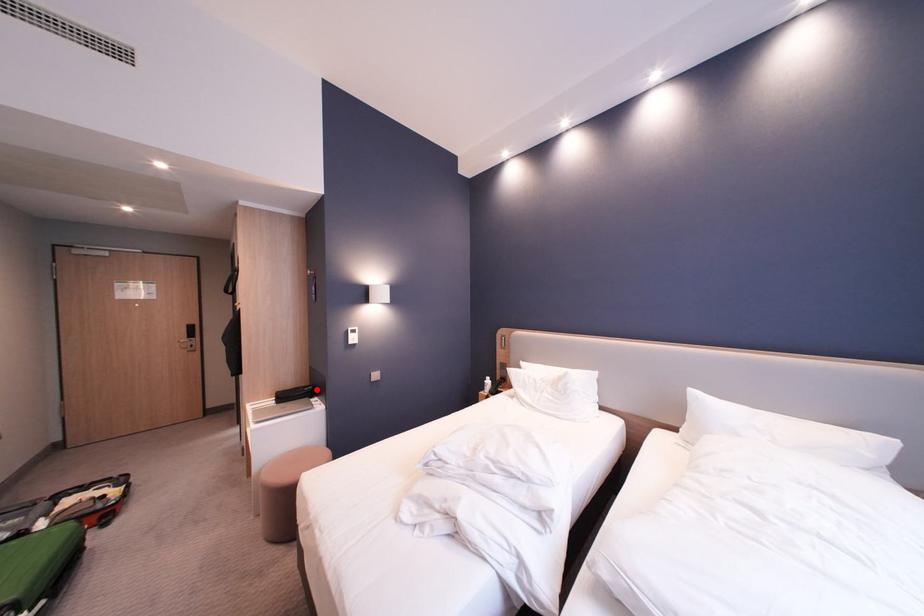
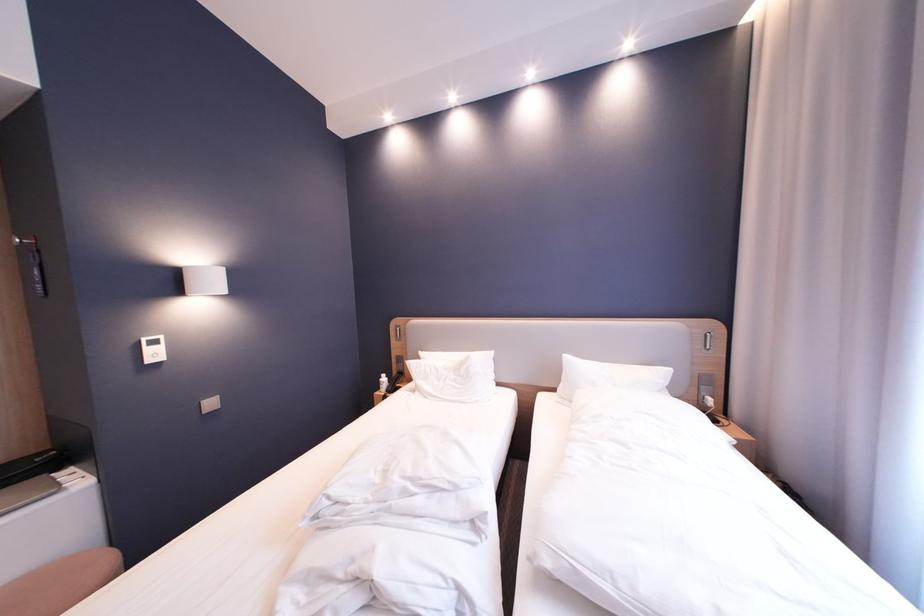
Question: I am providing you with two images of the same scene from different viewpoints. In image1, a red point is highlighted. Considering the same 3D point in image2, which of the following is correct?

Choices:
 (A) It is closer
 (B) It is farther

Answer: (A)